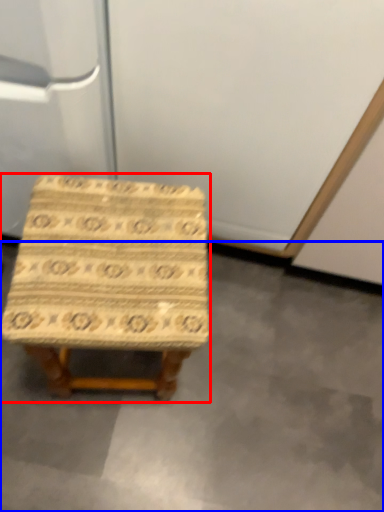
Question: Which object is further to the camera taking this photo, stool (highlighted by a red box) or concrete (highlighted by a blue box)?

Choices:
 (A) stool
 (B) concrete

Answer: (B)